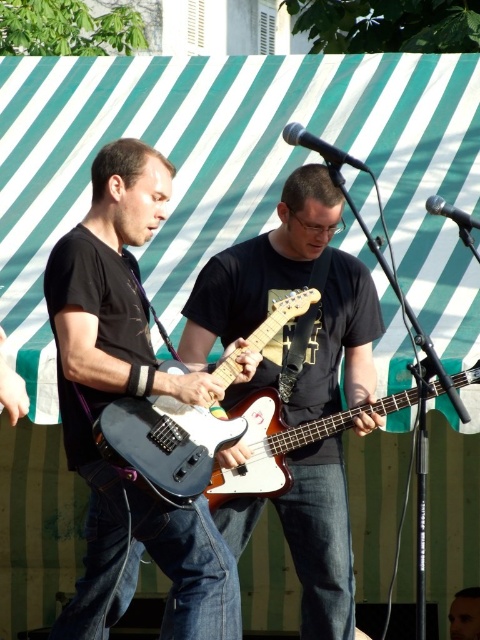
You are standing in front of the stage and want to take a photo of the two points on the backdrop. The first point is at coordinates point (454, 376) and the second point is at point (468, 612). Which point will appear larger in your photo?

Point (454, 376) will appear larger in the photo because it is closer to the camera than point (468, 612).

Looking at this image, you are a photographer at this outdoor music event. You need to capture a clear shot of both the white glossy bass guitar at center and the smooth skin face at center. Based on their positions, which one should you focus on first to ensure both are in frame?

The white glossy bass guitar at center is located above the smooth skin face at center, so you should focus on the smooth skin face at center first to ensure both are in frame.

You are standing in front of the stage and want to determine which of the two points, point (312, 230) or point (245, 417), is closer to you. Can you figure it out?

Point (312, 230) is closer to you because it is further to the viewer than point (245, 417).